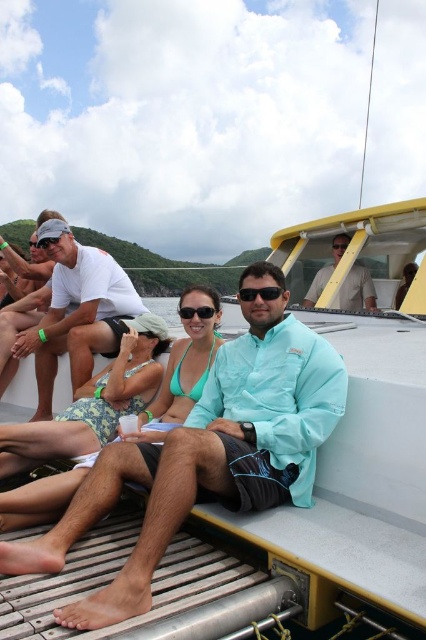
Does point (203, 316) come closer to viewer compared to point (2, 259)?

That is True.

Which is in front, point (204, 308) or point (2, 259)?

Point (204, 308) is in front.

Is point (199, 307) positioned before point (0, 253)?

Yes, it is.

Locate an element on the screen. The height and width of the screenshot is (640, 426). matte black sunglasses at center is located at coordinates (196, 310).

In the scene shown: Does light beige shirt at center lie in front of black plastic goggles at center?

Yes, light beige shirt at center is closer to the viewer.

Which is behind, point (368, 291) or point (336, 244)?

The point (336, 244) is behind.

I want to click on light beige shirt at center, so click(356, 291).

Between point (328, 358) and point (362, 296), which one is positioned behind?

Positioned behind is point (362, 296).

Can you confirm if teal fabric shirt at center is bigger than light beige shirt at center?

Correct, teal fabric shirt at center is larger in size than light beige shirt at center.

Which is in front, point (256, 330) or point (344, 298)?

Point (256, 330) is more forward.

Find the location of a particular element. teal fabric shirt at center is located at coordinates (207, 452).